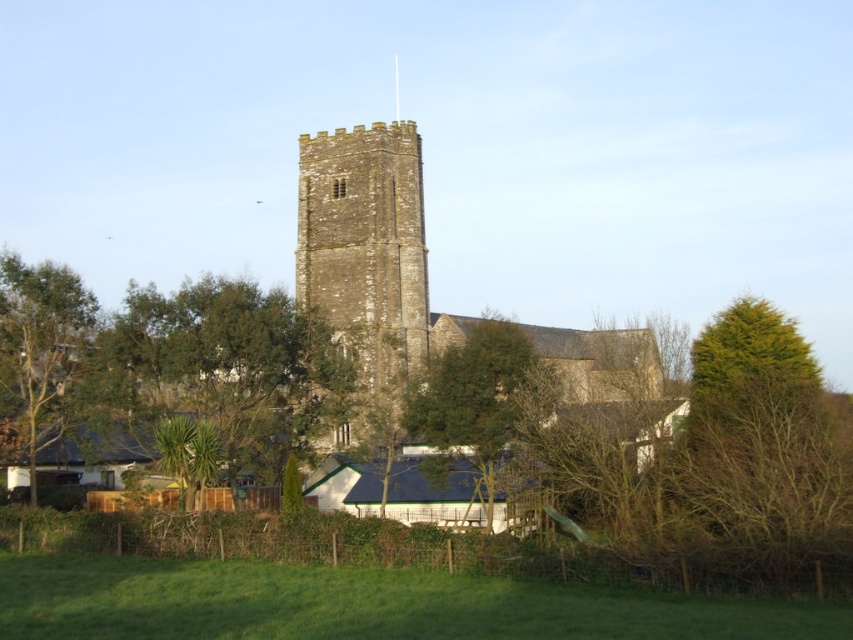
Question: Which is nearer to the green leafy tree at center?

Choices:
 (A) brown stone tower at center
 (B) brown stone church at center

Answer: (B)

Question: Which point is farther to the camera?

Choices:
 (A) (303, 252)
 (B) (337, 179)

Answer: (A)

Question: Can you confirm if brown stone tower at center is positioned below green leafy tree at center?

Choices:
 (A) no
 (B) yes

Answer: (A)

Question: Can you confirm if brown stone church at center is positioned below brown stone tower at center?

Choices:
 (A) no
 (B) yes

Answer: (B)

Question: Is brown stone tower at center positioned at the back of green leafy tree at center?

Choices:
 (A) no
 (B) yes

Answer: (B)

Question: Estimate the real-world distances between objects in this image. Which object is closer to the green leafy tree at center?

Choices:
 (A) brown stone tower at center
 (B) brown stone church at center

Answer: (B)